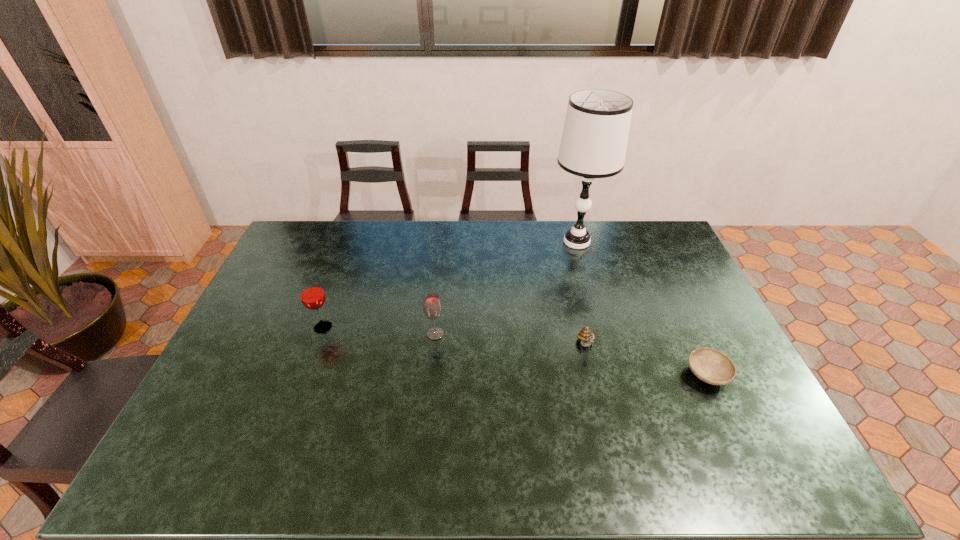
Where is `vacant area between the left glass drink container and the third shortest object`? The height and width of the screenshot is (540, 960). vacant area between the left glass drink container and the third shortest object is located at coordinates (379, 330).

Where is `vacant space in between the shortest object and the second shortest object`? Image resolution: width=960 pixels, height=540 pixels. vacant space in between the shortest object and the second shortest object is located at coordinates (646, 360).

I want to click on empty space that is in between the snail and the left glass drink container, so click(454, 336).

Where is `free space that is in between the shortest object and the tallest object`? The width and height of the screenshot is (960, 540). free space that is in between the shortest object and the tallest object is located at coordinates (642, 308).

Image resolution: width=960 pixels, height=540 pixels. In order to click on vacant area that lies between the second object from left to right and the farthest object in this screenshot , I will do `click(506, 288)`.

I want to click on free space that is in between the table lamp and the right glass drink container, so click(506, 288).

Find the location of a particular element. The height and width of the screenshot is (540, 960). vacant point located between the third shortest object and the fourth tallest object is located at coordinates (511, 340).

The height and width of the screenshot is (540, 960). Identify the location of empty location between the shorter glass drink container and the shortest object. (571, 354).

You are a GUI agent. You are given a task and a screenshot of the screen. Output one action in this format:
    pyautogui.click(x=<x>, y=<y>)
    Task: Click on the object that is the second nearest to the leftmost object
    
    Given the screenshot: What is the action you would take?
    pyautogui.click(x=585, y=335)

Locate an element on the screen. The image size is (960, 540). the fourth closest object to the left glass drink container is located at coordinates (711, 366).